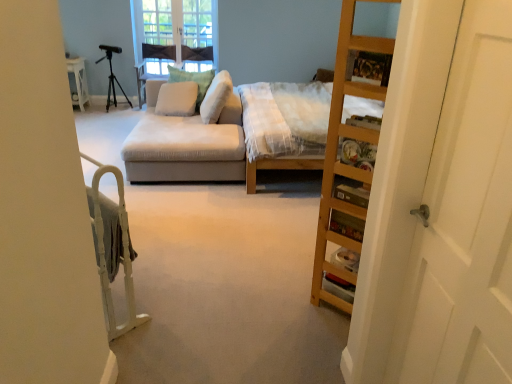
Question: From the image's perspective, is beige fabric pillow at center, the 3th pillow positioned from the right, above or below green textured pillow at center, which is the second pillow from left to right?

Choices:
 (A) above
 (B) below

Answer: (B)

Question: In terms of height, does beige fabric pillow at center, the 3th pillow positioned from the right, look taller or shorter compared to green textured pillow at center, which is the second pillow from left to right?

Choices:
 (A) tall
 (B) short

Answer: (B)

Question: Which is nearer to the white fabric pillow at center, placed as the third pillow when sorted from left to right?

Choices:
 (A) white wooden door at right
 (B) green textured pillow at center, which is the second pillow from left to right
 (C) beige fabric pillow at center, the 3th pillow positioned from the right
 (D) white wood bed frame at left
 (E) wooden bookshelf at right

Answer: (C)

Question: Based on their relative distances, which object is farther from the green textured pillow at center, which is the second pillow from left to right?

Choices:
 (A) clear glass window at upper center
 (B) white wooden door at right
 (C) white fabric pillow at center, placed as the third pillow when sorted from left to right
 (D) beige fabric pillow at center, acting as the first pillow starting from the left
 (E) white wood bed frame at left

Answer: (B)